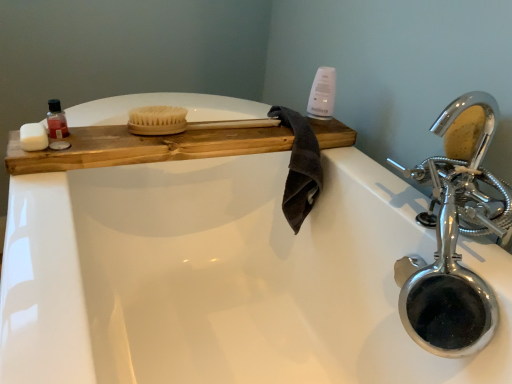
Question: Could you tell me if wooden tray at upper left is facing translucent plastic bottle at upper left?

Choices:
 (A) yes
 (B) no

Answer: (B)

Question: From the image's perspective, is wooden tray at upper left on top of translucent plastic bottle at upper left?

Choices:
 (A) yes
 (B) no

Answer: (B)

Question: Does wooden tray at upper left have a greater width compared to translucent plastic bottle at upper left?

Choices:
 (A) yes
 (B) no

Answer: (A)

Question: From a real-world perspective, is wooden tray at upper left located higher than translucent plastic bottle at upper left?

Choices:
 (A) yes
 (B) no

Answer: (B)

Question: Does wooden tray at upper left have a greater height compared to translucent plastic bottle at upper left?

Choices:
 (A) no
 (B) yes

Answer: (A)

Question: Is point (51, 117) closer or farther from the camera than point (436, 294)?

Choices:
 (A) farther
 (B) closer

Answer: (A)

Question: Looking at their shapes, would you say translucent plastic bottle at upper left is wider or thinner than chrome metallic faucet at upper right?

Choices:
 (A) wide
 (B) thin

Answer: (B)

Question: Visually, is translucent plastic bottle at upper left positioned to the left or to the right of chrome metallic faucet at upper right?

Choices:
 (A) left
 (B) right

Answer: (A)

Question: Is translucent plastic bottle at upper left in front of or behind chrome metallic faucet at upper right in the image?

Choices:
 (A) behind
 (B) front

Answer: (A)

Question: From the image's perspective, relative to wooden tray at upper left, is chrome/metallic faucet at right above or below?

Choices:
 (A) below
 (B) above

Answer: (A)

Question: Is chrome/metallic faucet at right bigger or smaller than wooden tray at upper left?

Choices:
 (A) big
 (B) small

Answer: (B)

Question: Does point (489, 119) appear closer or farther from the camera than point (123, 125)?

Choices:
 (A) farther
 (B) closer

Answer: (B)

Question: From a real-world perspective, is chrome/metallic faucet at right physically located above or below wooden tray at upper left?

Choices:
 (A) above
 (B) below

Answer: (A)

Question: Considering the positions of dark brown cotton towel at center and natural wood brush at center in the image, is dark brown cotton towel at center bigger or smaller than natural wood brush at center?

Choices:
 (A) big
 (B) small

Answer: (A)

Question: From the image's perspective, relative to natural wood brush at center, is dark brown cotton towel at center above or below?

Choices:
 (A) above
 (B) below

Answer: (B)